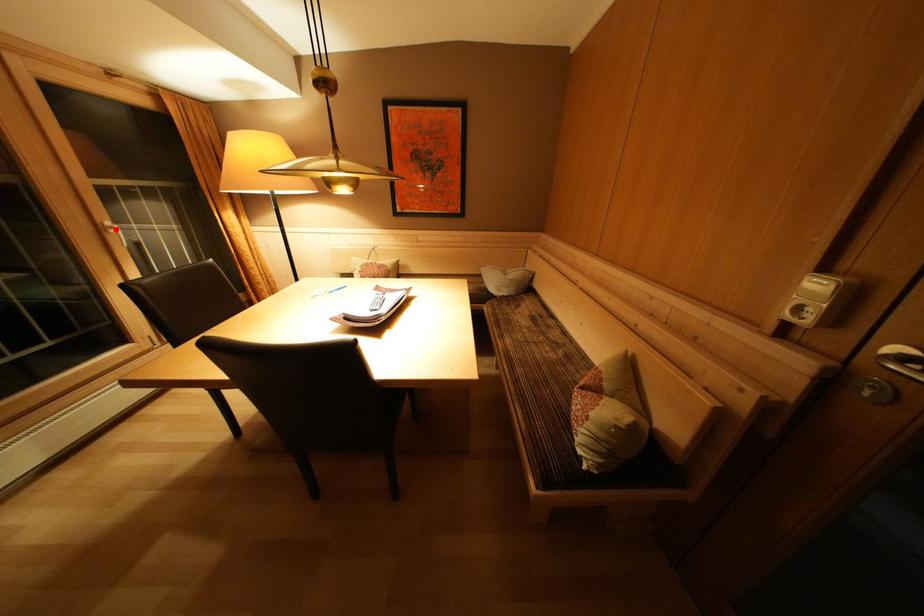
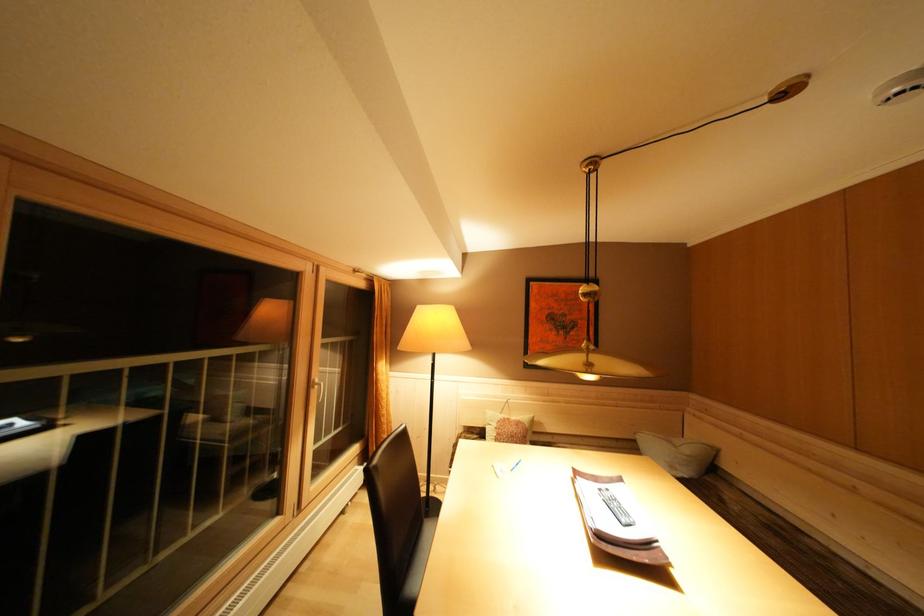
The point at the highlighted location is marked in the first image. Where is the corresponding point in the second image?

(323, 386)